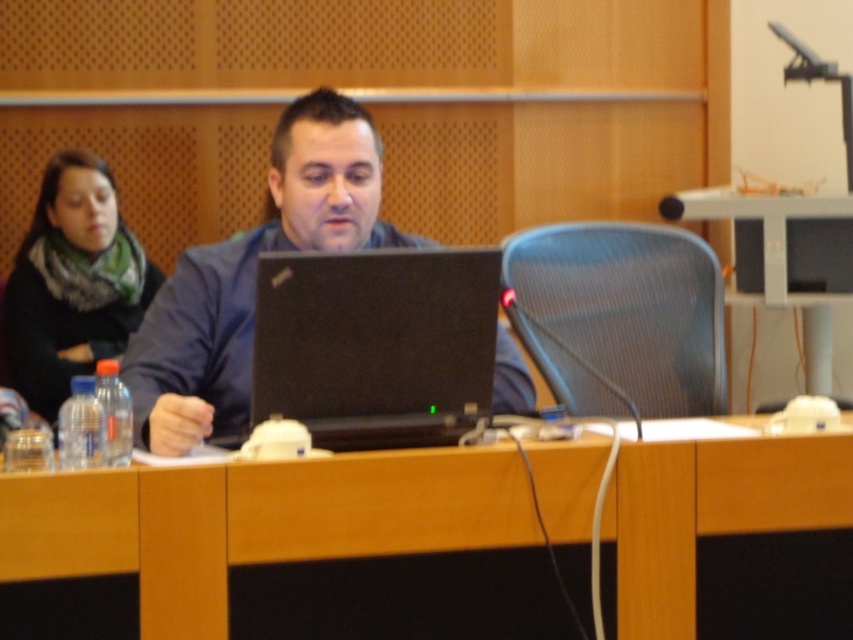
Question: Where is black matte laptop at center located in relation to matte black laptop at center in the image?

Choices:
 (A) below
 (B) above

Answer: (A)

Question: Which of the following is the farthest from the observer?

Choices:
 (A) (193, 563)
 (B) (347, 172)
 (C) (793, 305)

Answer: (C)

Question: Considering the real-world distances, which object is farthest from the wooden table at center?

Choices:
 (A) matte black laptop at center
 (B) black knit scarf at left
 (C) black matte laptop at center
 (D) metallic silver table at center

Answer: (D)

Question: Can you confirm if black matte laptop at center is smaller than black knit scarf at left?

Choices:
 (A) no
 (B) yes

Answer: (B)

Question: Which point is closer to the camera?

Choices:
 (A) black matte laptop at center
 (B) metallic silver table at center
 (C) wooden table at center
 (D) black knit scarf at left

Answer: (C)

Question: Does wooden table at center appear on the left side of black matte laptop at center?

Choices:
 (A) no
 (B) yes

Answer: (A)